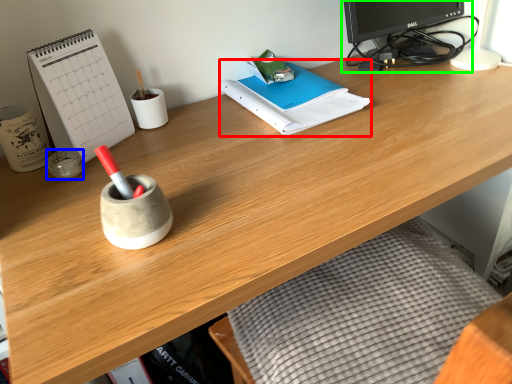
Question: Which object is the closest to the notebook (highlighted by a red box)? Choose among these: stationery (highlighted by a blue box) or desktop computer (highlighted by a green box).

Choices:
 (A) stationery
 (B) desktop computer

Answer: (B)